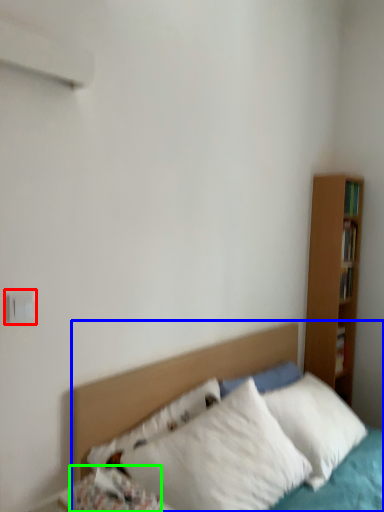
Question: Based on their relative distances, which object is nearer to electric outlet (highlighted by a red box)? Choose from bed (highlighted by a blue box) and pillow (highlighted by a green box).

Choices:
 (A) bed
 (B) pillow

Answer: (B)